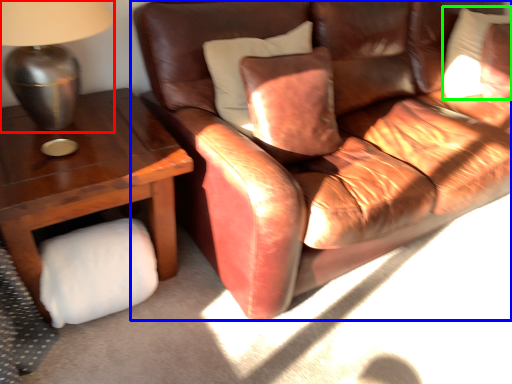
Question: Based on their relative distances, which object is nearer to table lamp (highlighted by a red box)? Choose from studio couch (highlighted by a blue box) and pillow (highlighted by a green box).

Choices:
 (A) studio couch
 (B) pillow

Answer: (A)